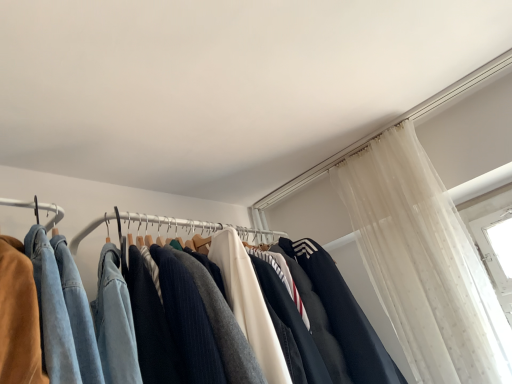
Image resolution: width=512 pixels, height=384 pixels. What are the coordinates of `sheer white curtain at upper right` in the screenshot? It's located at (424, 263).

The image size is (512, 384). What do you see at coordinates (424, 263) in the screenshot? I see `sheer white curtain at upper right` at bounding box center [424, 263].

Find the location of a particular element. This screenshot has height=384, width=512. sheer white curtain at upper right is located at coordinates (424, 263).